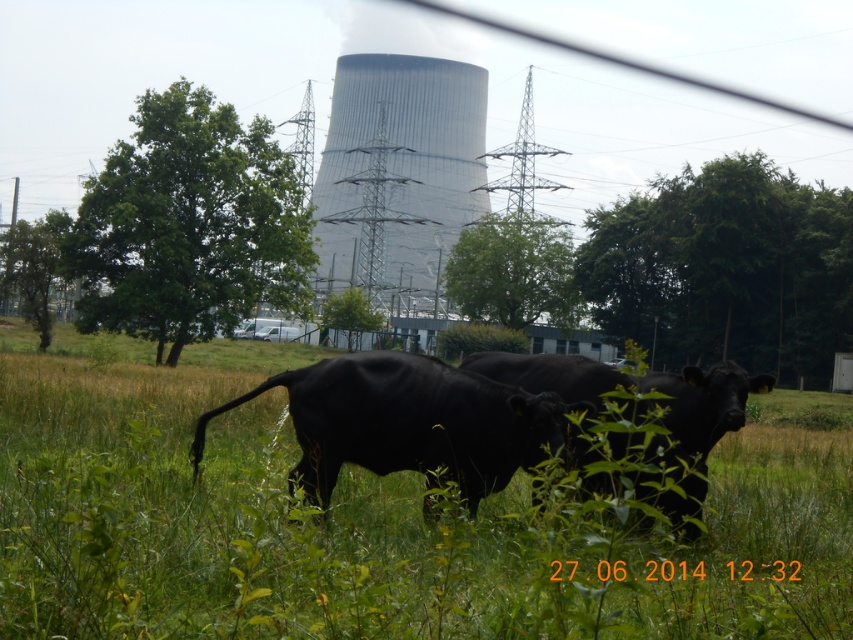
You are a farmer checking your animals in the field. You notice the black matte cow at center and the black glossy bull at center. Which animal is positioned lower in the image?

The black matte cow at center is located below the black glossy bull at center, so it is positioned lower in the image.

You are a photographer standing in the field. You want to take a photo of the black matte cow at center and the black glossy bull at center. Which one will appear larger in the photo?

The black matte cow at center will appear larger in the photo because it is closer to the viewer than the black glossy bull at center.

You are a photographer trying to capture both the smooth concrete tower at center and the black glossy bull at center in a single frame. Based on their positions, which object should you adjust your camera angle to focus on first to ensure both are in the shot?

The smooth concrete tower at center is positioned on the left side of the black glossy bull at center, so you should focus on the black glossy bull at center first to ensure both are included in the frame.